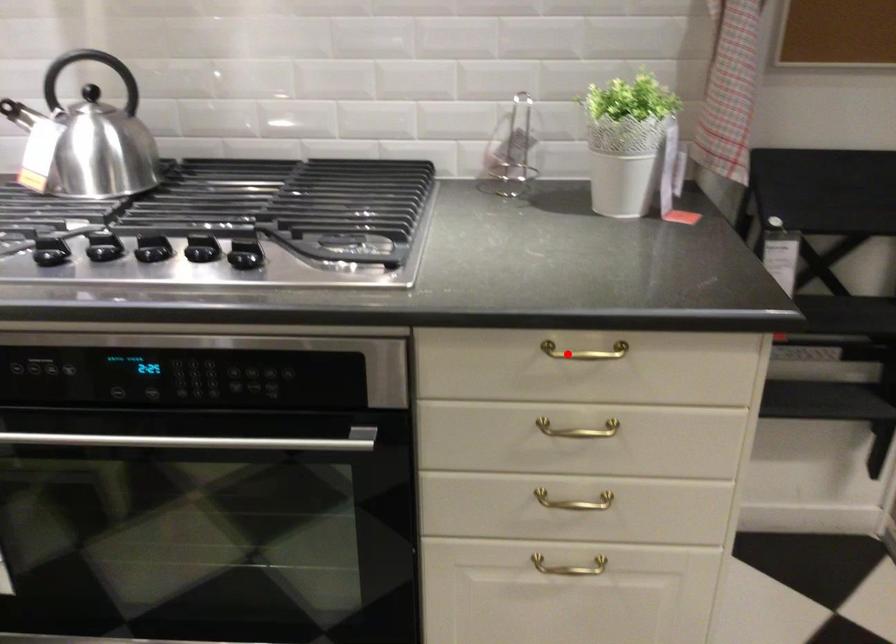
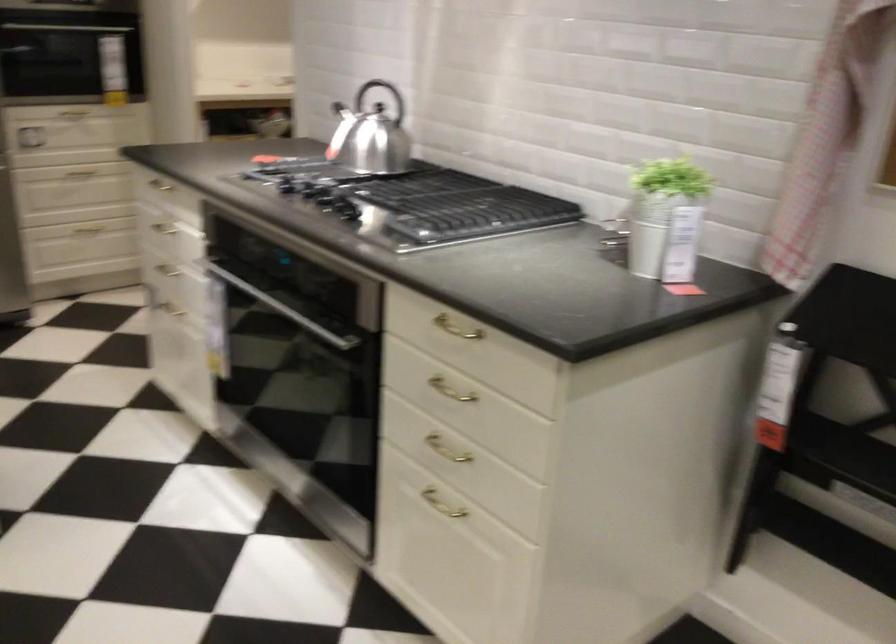
Question: I am providing you with two images of the same scene from different viewpoints. In image1, a red point is highlighted. Considering the same 3D point in image2, which of the following is correct?

Choices:
 (A) It is closer
 (B) It is farther

Answer: (B)